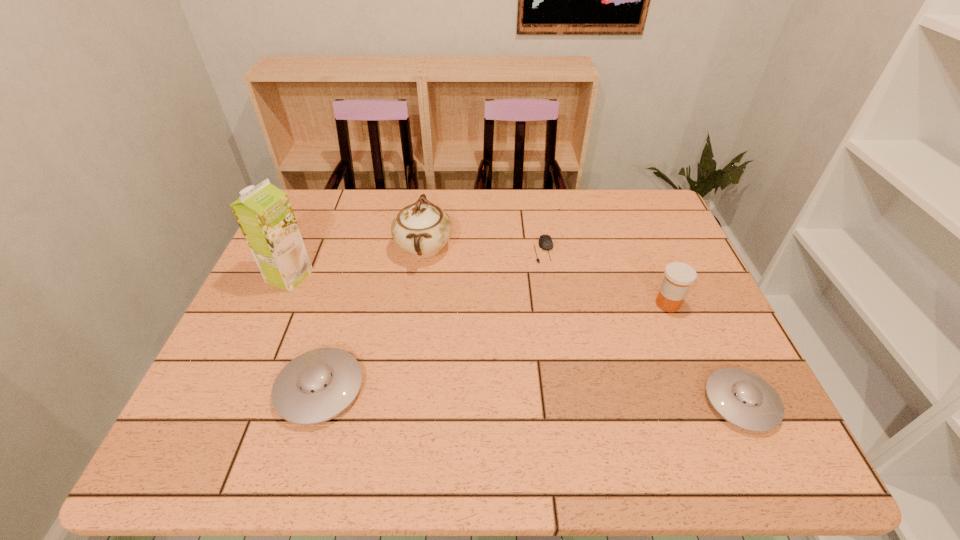
Please point a location where one more saucer can be added evenly. Please provide its 2D coordinates. Your answer should be formatted as a tuple, i.e. [(x, y)], where the tuple contains the x and y coordinates of a point satisfying the conditions above.

[(528, 395)]